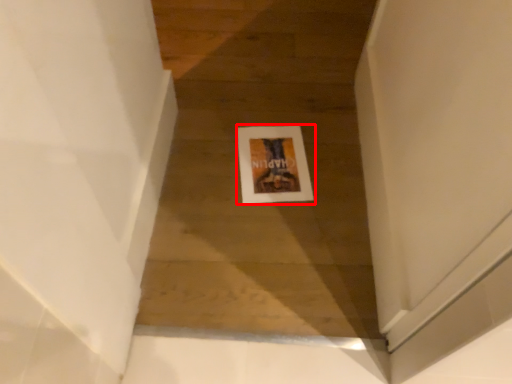
Question: From the image's perspective, where is picture frame (annotated by the red box) located in relation to stairwell in the image?

Choices:
 (A) above
 (B) below

Answer: (A)